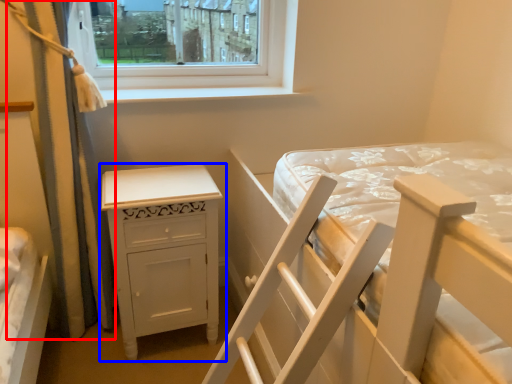
Question: Which object is closer to the camera taking this photo, curtain (highlighted by a red box) or nightstand (highlighted by a blue box)?

Choices:
 (A) curtain
 (B) nightstand

Answer: (A)